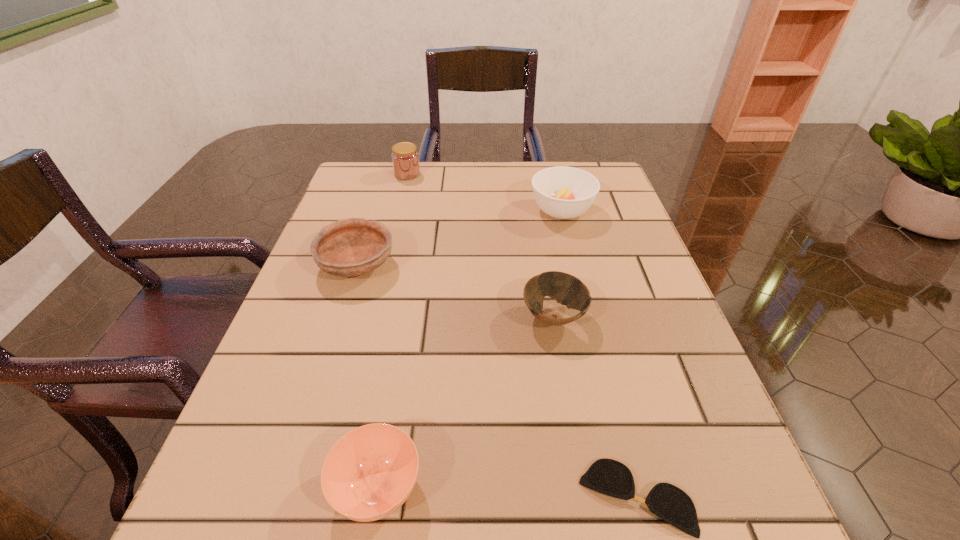
Find the location of a particular element. the fifth closest object to the right soup bowl is located at coordinates (369, 473).

The width and height of the screenshot is (960, 540). In order to click on object that ranks as the fifth closest to the spectacles in this screenshot , I will do `click(405, 158)`.

You are a GUI agent. You are given a task and a screenshot of the screen. Output one action in this format:
    pyautogui.click(x=<x>, y=<y>)
    Task: Click on the vacant point that satisfies the following two spatial constraints: 1. on the front side of the shortest object; 2. on the right side of the fourth farthest object
    
    Given the screenshot: What is the action you would take?
    pyautogui.click(x=584, y=497)

At what (x,y) coordinates should I click in order to perform the action: click on vacant space that satisfies the following two spatial constraints: 1. on the back side of the nearer soup bowl; 2. on the right side of the taller soup bowl. Please return your answer as a coordinate pair (x, y). The width and height of the screenshot is (960, 540). Looking at the image, I should click on (424, 211).

What are the coordinates of `free spot that satisfies the following two spatial constraints: 1. on the front side of the shortest object; 2. on the left side of the left bowl` in the screenshot? It's located at (283, 497).